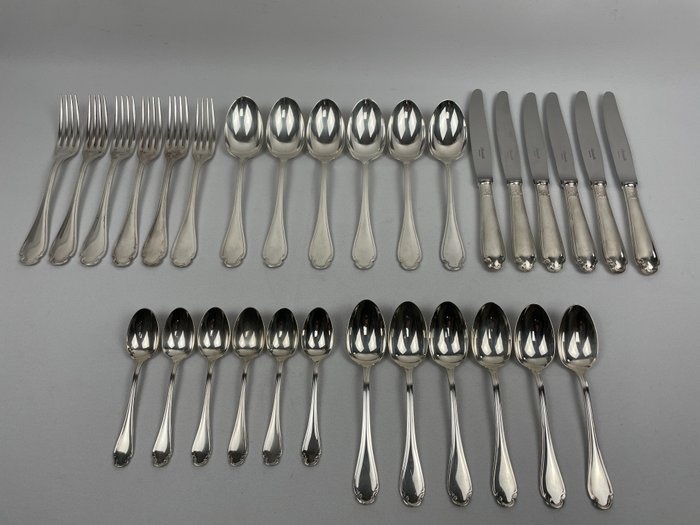
You are a GUI agent. You are given a task and a screenshot of the screen. Output one action in this format:
    pyautogui.click(x=<x>, y=<y>)
    Task: Click on the silver butter knives
    The image size is (700, 525).
    Given the screenshot: What is the action you would take?
    pyautogui.click(x=480, y=133), pyautogui.click(x=505, y=141), pyautogui.click(x=528, y=135), pyautogui.click(x=558, y=136), pyautogui.click(x=587, y=139), pyautogui.click(x=619, y=131)